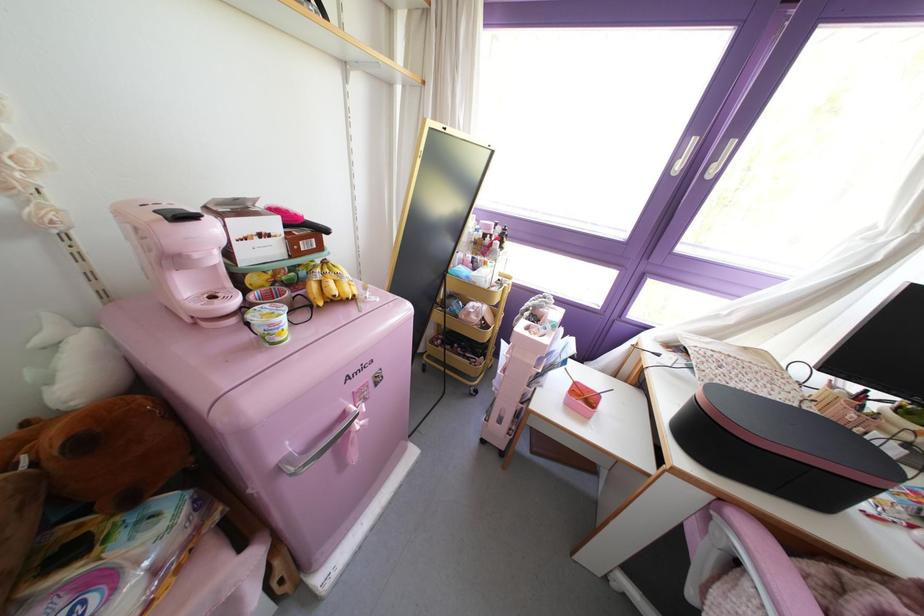
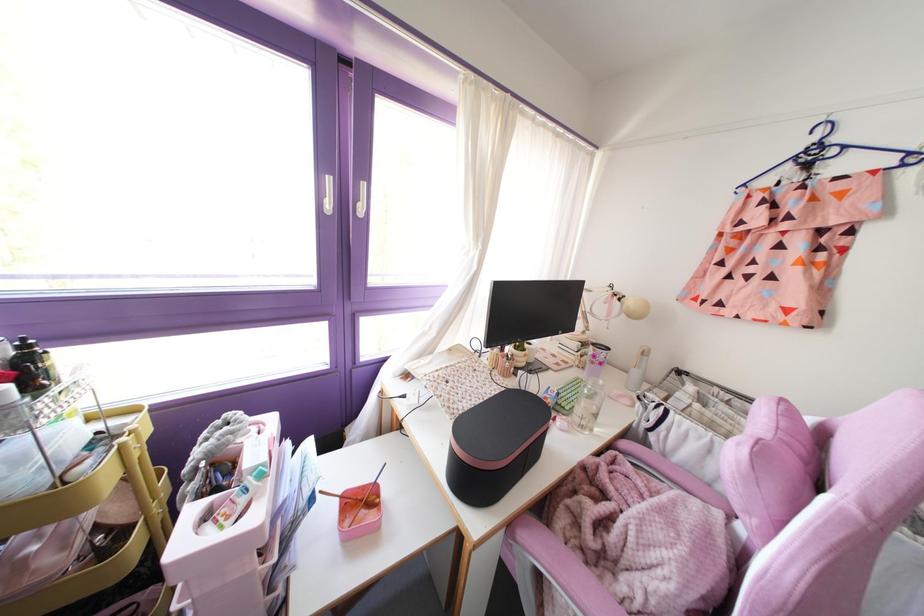
Where in the second image is the point corresponding to [586,387] from the first image?

(359, 487)